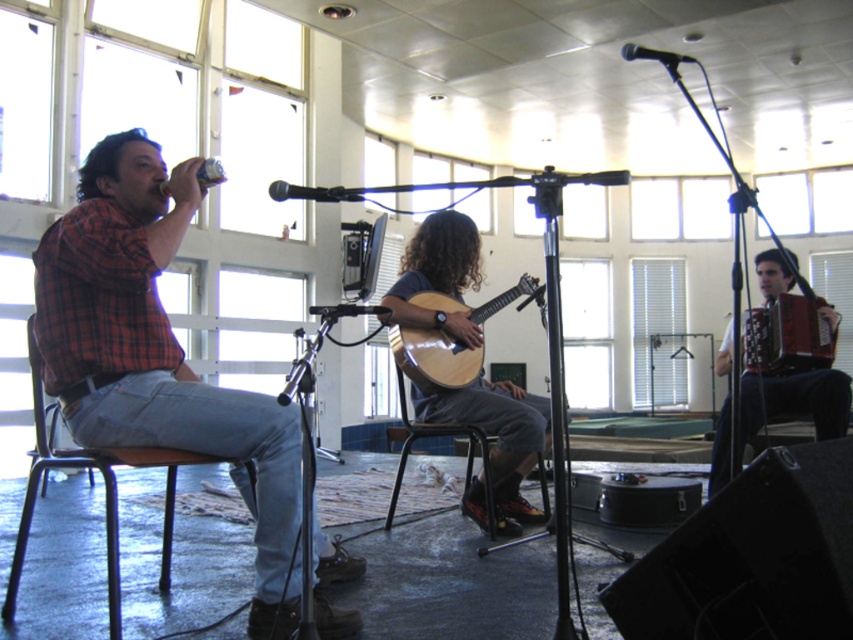
Question: Is metallic brown chair at left smaller than black matte microphone at upper center?

Choices:
 (A) no
 (B) yes

Answer: (A)

Question: Which of the following is the closest to the observer?

Choices:
 (A) (209, 180)
 (B) (339, 188)
 (C) (724, 452)

Answer: (B)

Question: Is plaid shirt at left thinner than wooden acoustic guitar at center?

Choices:
 (A) no
 (B) yes

Answer: (A)

Question: Which point is closer to the camera?

Choices:
 (A) (775, 349)
 (B) (233, 388)

Answer: (B)

Question: Among these points, which one is farthest from the camera?

Choices:
 (A) (714, 474)
 (B) (350, 196)

Answer: (A)

Question: Is wooden acoustic guitar at center closer to the viewer compared to metallic silver microphone at upper left?

Choices:
 (A) yes
 (B) no

Answer: (B)